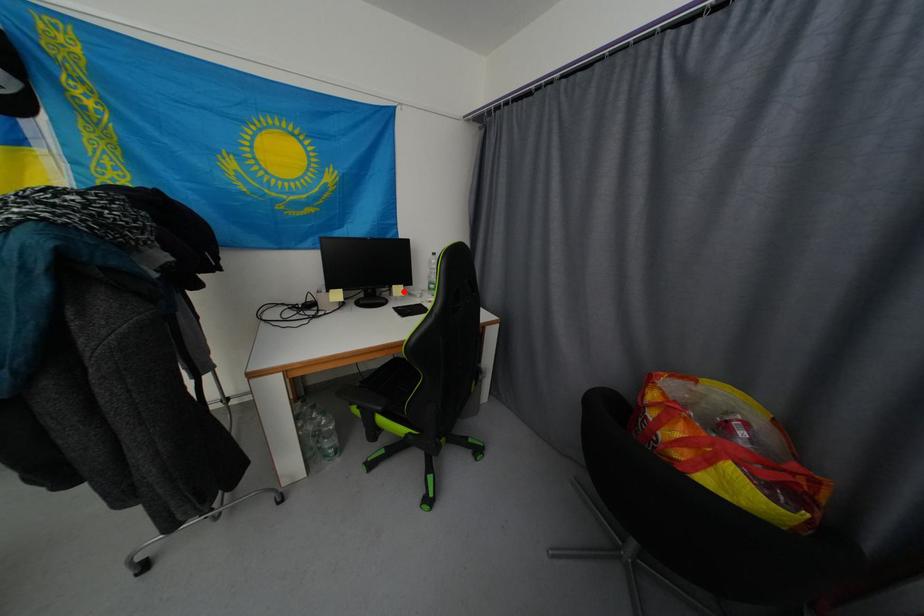
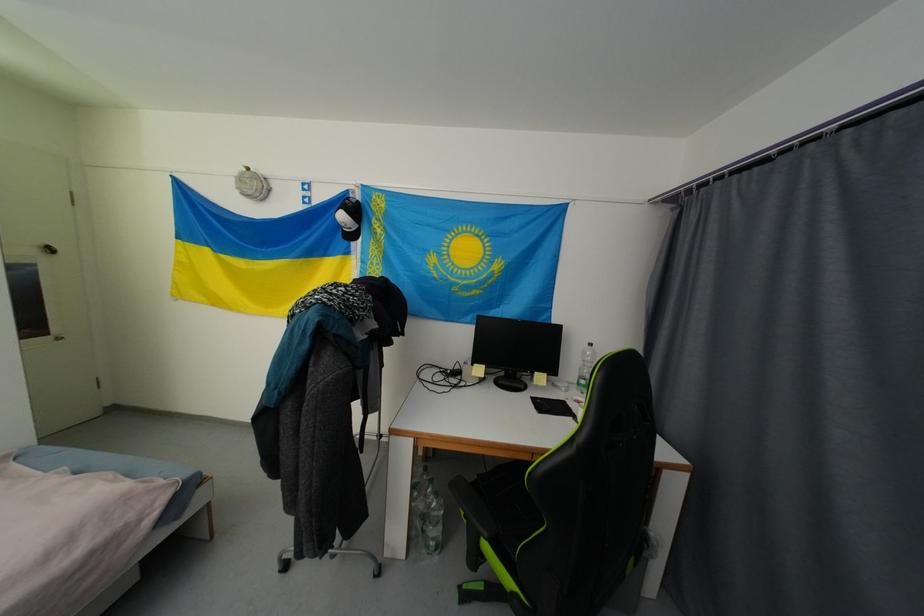
Question: I am providing you with two images of the same scene from different viewpoints. In image1, a red point is highlighted. Considering the same 3D point in image2, which of the following is correct?

Choices:
 (A) It is closer
 (B) It is farther

Answer: (B)